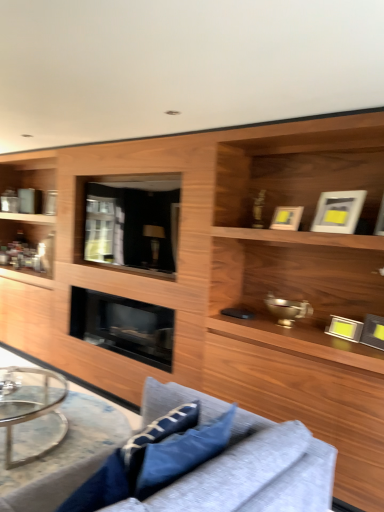
Question: Considering the positions of clear glass round table at lower left and blue fabric pillow at lower center, the 2th pillow viewed from the front, in the image, is clear glass round table at lower left bigger or smaller than blue fabric pillow at lower center, the 2th pillow viewed from the front,?

Choices:
 (A) big
 (B) small

Answer: (A)

Question: From a real-world perspective, is clear glass round table at lower left positioned above or below blue fabric pillow at lower center, which ranks as the first pillow in back-to-front order?

Choices:
 (A) below
 (B) above

Answer: (A)

Question: Based on their relative distances, which object is farther from the transparent glass door at center?

Choices:
 (A) blue fabric pillow at lower center, acting as the second pillow starting from the left
 (B) black glass fireplace at center
 (C) clear glass round table at lower left
 (D) textured gray fabric couch at lower center
 (E) clear glass coffee table at lower left

Answer: (A)

Question: Considering the real-world distances, which object is closest to the transparent glass door at center?

Choices:
 (A) clear glass coffee table at lower left
 (B) textured gray fabric couch at lower center
 (C) black glass fireplace at center
 (D) blue fabric pillow at lower center, which ranks as the first pillow in back-to-front order
 (E) blue fabric pillow at lower center, which is counted as the 1th pillow, starting from the front

Answer: (C)